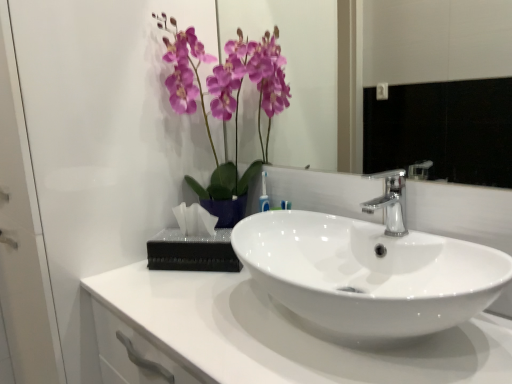
Find the location of `vacant area in front of translucent plastic tissue at center`. vacant area in front of translucent plastic tissue at center is located at coordinates (185, 288).